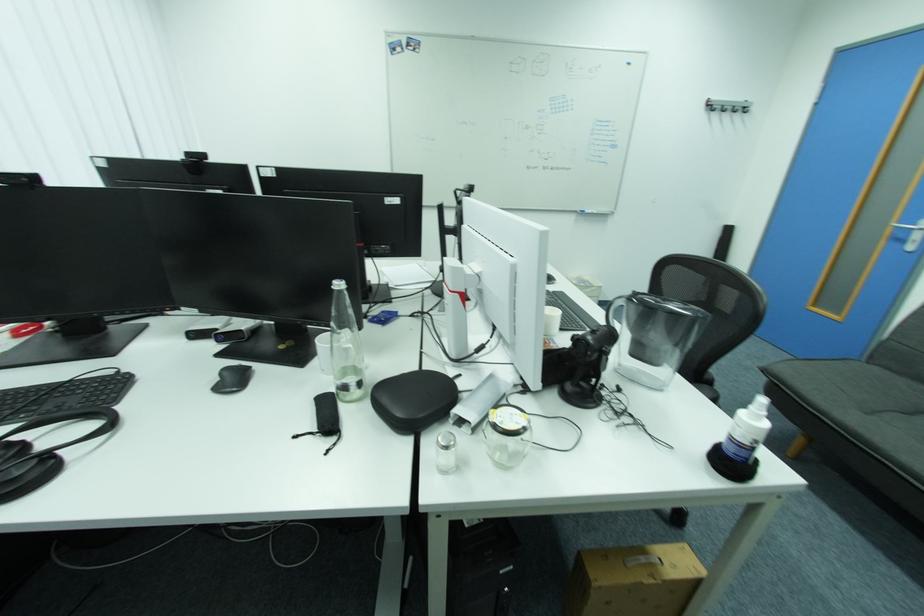
You are a GUI agent. You are given a task and a screenshot of the screen. Output one action in this format:
    pyautogui.click(x=<x>, y=<y>)
    Task: Click on the whiteboard marker
    
    Given the screenshot: What is the action you would take?
    click(594, 209)